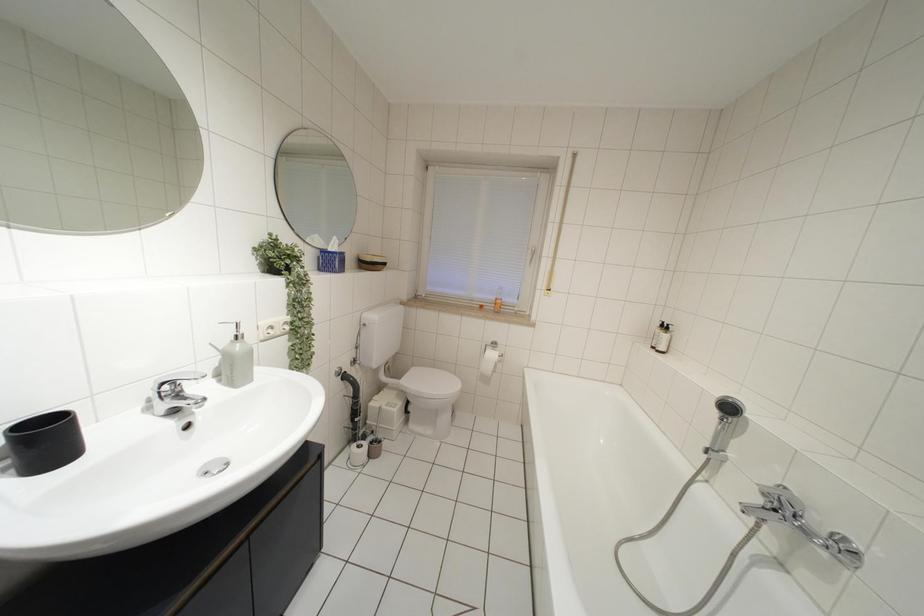
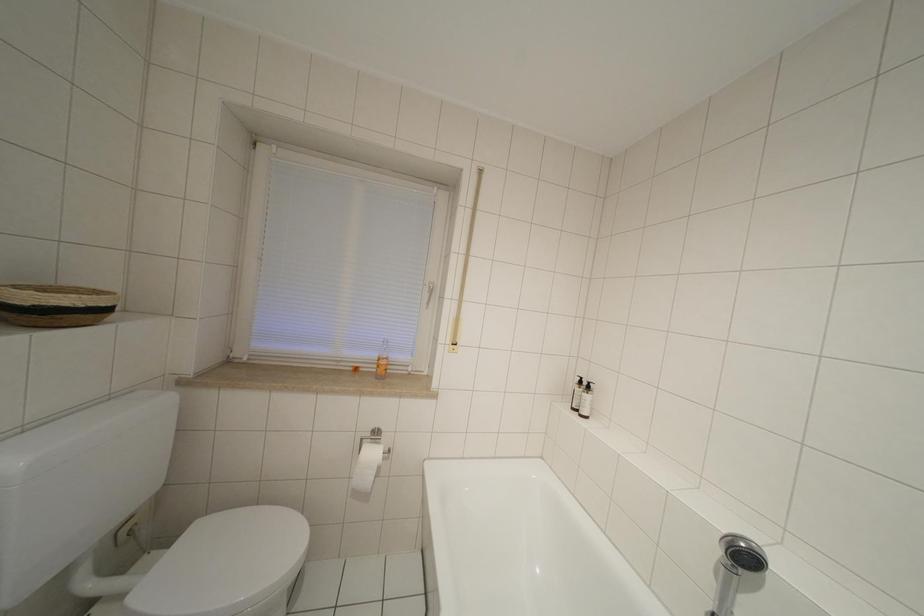
Question: The camera is either moving clockwise (left) or counter-clockwise (right) around the object. The first image is from the beginning of the video and the second image is from the end. Is the camera moving left or right when shooting the video?

Choices:
 (A) Left
 (B) Right

Answer: (A)